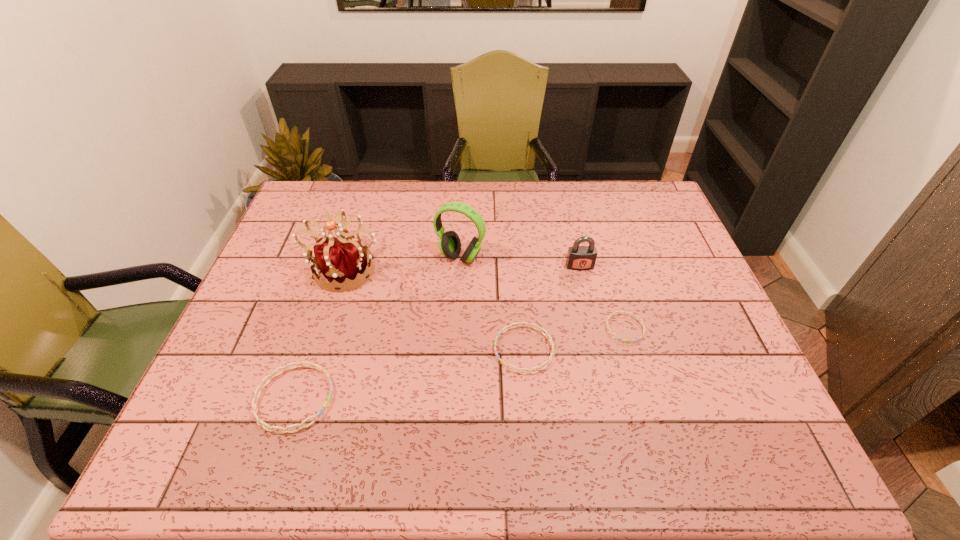
At what (x,y) coordinates should I click in order to perform the action: click on free spot that satisfies the following two spatial constraints: 1. on the front of the padlock near the keyhole; 2. on the surface of the second bracelet from left to right showing star-shaped elements. Please return your answer as a coordinate pair (x, y). Looking at the image, I should click on point(599,349).

Where is `vacant position in the image that satisfies the following two spatial constraints: 1. on the front of the fourth shortest object near the keyhole; 2. on the surface of the second bracelet from left to right showing star-shaped elements`? The width and height of the screenshot is (960, 540). vacant position in the image that satisfies the following two spatial constraints: 1. on the front of the fourth shortest object near the keyhole; 2. on the surface of the second bracelet from left to right showing star-shaped elements is located at coordinates (599, 349).

Identify the location of free space that satisfies the following two spatial constraints: 1. on the surface of the shortest bracelet showing star-shaped elements; 2. on the surface of the second bracelet from left to right showing star-shaped elements. (631, 349).

Locate an element on the screen. The width and height of the screenshot is (960, 540). vacant space that satisfies the following two spatial constraints: 1. on the front of the padlock near the keyhole; 2. on the surface of the leftmost bracelet showing star-shaped elements is located at coordinates (611, 399).

What are the coordinates of `blank area in the image that satisfies the following two spatial constraints: 1. on the surface of the shortest object showing star-shaped elements; 2. on the surface of the second shortest bracelet showing star-shaped elements` in the screenshot? It's located at (631, 349).